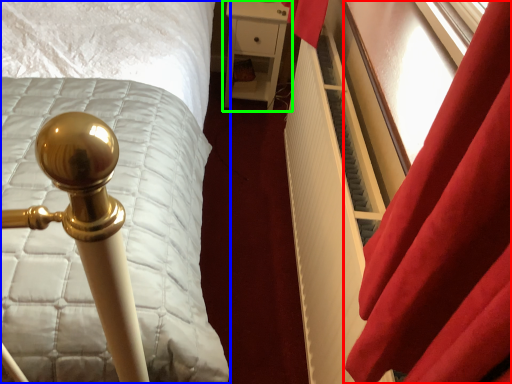
Question: Estimate the real-world distances between objects in this image. Which object is farther from curtain (highlighted by a red box), bed (highlighted by a blue box) or furniture (highlighted by a green box)?

Choices:
 (A) bed
 (B) furniture

Answer: (B)